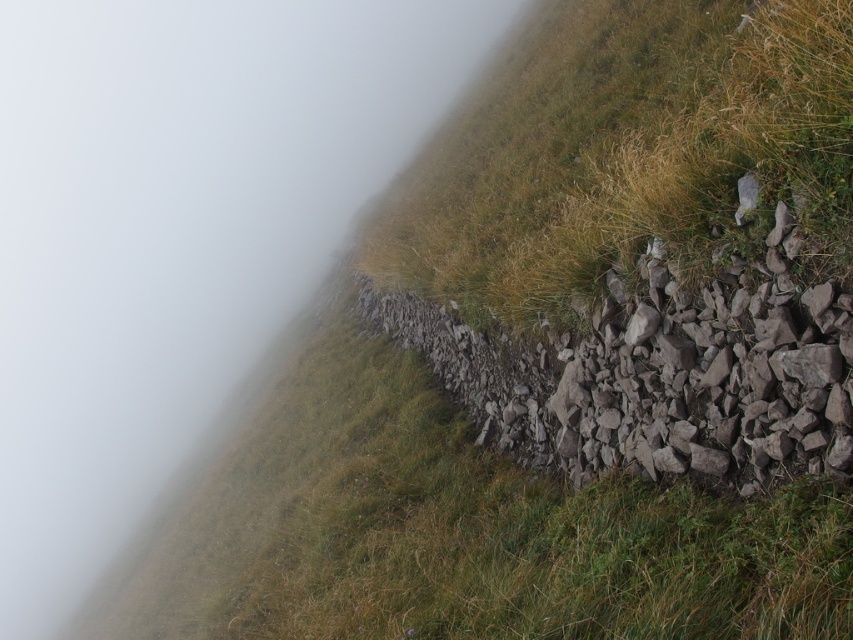
Is white mist at upper left to the right of gray rough stone at right from the viewer's perspective?

No, white mist at upper left is not to the right of gray rough stone at right.

Describe the element at coordinates (177, 234) in the screenshot. The image size is (853, 640). I see `white mist at upper left` at that location.

The width and height of the screenshot is (853, 640). What are the coordinates of `white mist at upper left` in the screenshot? It's located at (177, 234).